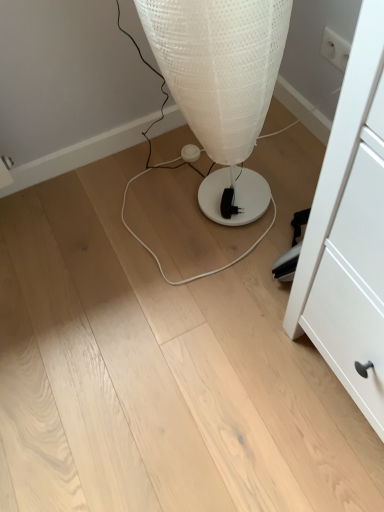
Locate an element on the screen. vacant area located to the right-hand side of white matte lamp at center is located at coordinates (288, 168).